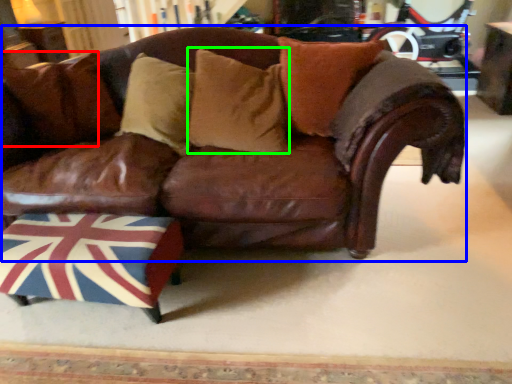
Question: Considering the real-world distances, which object is farthest from pillow (highlighted by a red box)? studio couch (highlighted by a blue box) or pillow (highlighted by a green box)?

Choices:
 (A) studio couch
 (B) pillow

Answer: (B)